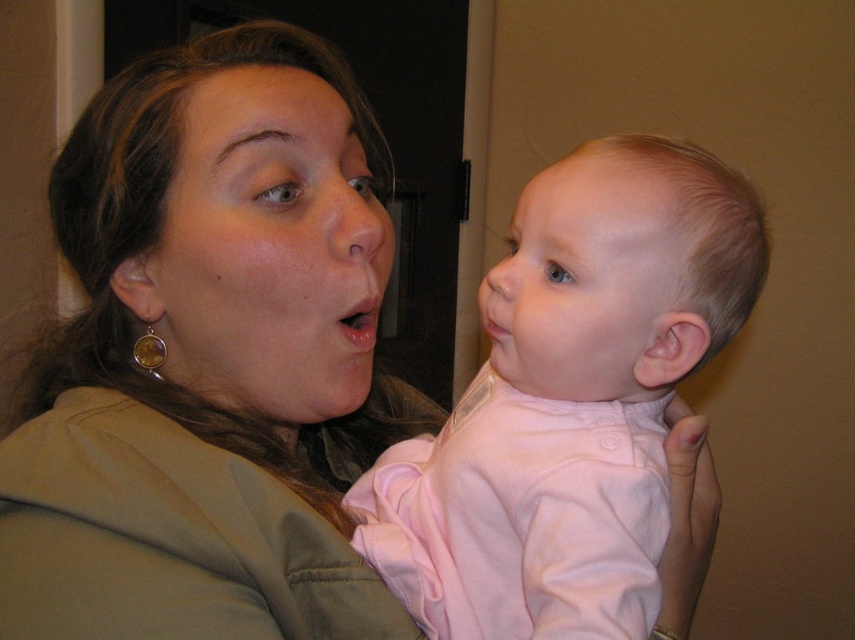
You are a photographer trying to capture a close shot of the pink fabric baby at center and the matte pink lips at center. Which object is located below the other in the image?

The pink fabric baby at center is positioned under matte pink lips at center, so the baby is below the lips.

Based on the coordinates provided, can you identify which object in the scene corresponds to the point at location (x=208, y=358)?

The point at location (x=208, y=358) corresponds to the matte green jacket at upper left.

You are a photographer trying to capture a candid shot of the matte green jacket at upper left and the pink fabric baby at center. Since the jacket is taller than the baby, which object should you focus on first to ensure both are in frame?

The matte green jacket at upper left is taller than the pink fabric baby at center, so you should focus on positioning the taller jacket first to ensure both fit within the frame.